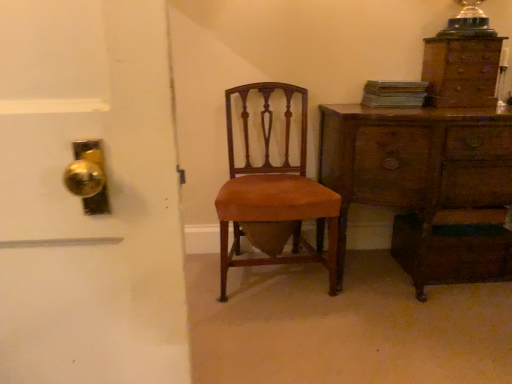
Question: Considering the relative sizes of wooden chest of drawers at right, the first chest of drawers positioned from the bottom, and brown wood chair at center in the image provided, is wooden chest of drawers at right, the first chest of drawers positioned from the bottom, bigger than brown wood chair at center?

Choices:
 (A) no
 (B) yes

Answer: (B)

Question: Considering the relative sizes of wooden chest of drawers at right, placed as the second chest of drawers when sorted from top to bottom, and brown wood chair at center in the image provided, is wooden chest of drawers at right, placed as the second chest of drawers when sorted from top to bottom, shorter than brown wood chair at center?

Choices:
 (A) no
 (B) yes

Answer: (B)

Question: Considering the relative sizes of wooden chest of drawers at right, placed as the second chest of drawers when sorted from top to bottom, and brown wood chair at center in the image provided, is wooden chest of drawers at right, placed as the second chest of drawers when sorted from top to bottom, wider than brown wood chair at center?

Choices:
 (A) yes
 (B) no

Answer: (A)

Question: From a real-world perspective, is wooden chest of drawers at right, placed as the second chest of drawers when sorted from top to bottom, positioned over brown wood chair at center based on gravity?

Choices:
 (A) no
 (B) yes

Answer: (A)

Question: Is wooden chest of drawers at right, the first chest of drawers positioned from the bottom, facing towards brown wood chair at center?

Choices:
 (A) no
 (B) yes

Answer: (A)

Question: From a real-world perspective, is wooden chest of drawers at right, placed as the second chest of drawers when sorted from top to bottom, above or below translucent glass lampshade at upper right?

Choices:
 (A) below
 (B) above

Answer: (A)

Question: Is wooden chest of drawers at right, the first chest of drawers positioned from the bottom, spatially inside translucent glass lampshade at upper right, or outside of it?

Choices:
 (A) outside
 (B) inside

Answer: (A)

Question: From the image's perspective, relative to translucent glass lampshade at upper right, is wooden chest of drawers at right, the first chest of drawers positioned from the bottom, above or below?

Choices:
 (A) above
 (B) below

Answer: (B)

Question: From their relative heights in the image, would you say wooden chest of drawers at right, the first chest of drawers positioned from the bottom, is taller or shorter than translucent glass lampshade at upper right?

Choices:
 (A) tall
 (B) short

Answer: (A)

Question: Considering the positions of brown wood chair at center and wooden chest of drawers at upper right, which appears as the first chest of drawers when viewed from the top, in the image, is brown wood chair at center taller or shorter than wooden chest of drawers at upper right, which appears as the first chest of drawers when viewed from the top,?

Choices:
 (A) short
 (B) tall

Answer: (B)

Question: From the image's perspective, is brown wood chair at center positioned above or below wooden chest of drawers at upper right, which appears as the first chest of drawers when viewed from the top?

Choices:
 (A) below
 (B) above

Answer: (A)

Question: Considering the positions of brown wood chair at center and wooden chest of drawers at upper right, which appears as the first chest of drawers when viewed from the top, in the image, is brown wood chair at center bigger or smaller than wooden chest of drawers at upper right, which appears as the first chest of drawers when viewed from the top,?

Choices:
 (A) small
 (B) big

Answer: (B)

Question: In the image, is brown wood chair at center positioned in front of or behind wooden chest of drawers at upper right, which appears as the first chest of drawers when viewed from the top?

Choices:
 (A) behind
 (B) front

Answer: (B)

Question: From the image's perspective, relative to brown wood chair at center, is translucent glass lampshade at upper right above or below?

Choices:
 (A) below
 (B) above

Answer: (B)

Question: Considering the positions of translucent glass lampshade at upper right and brown wood chair at center in the image, is translucent glass lampshade at upper right taller or shorter than brown wood chair at center?

Choices:
 (A) tall
 (B) short

Answer: (B)